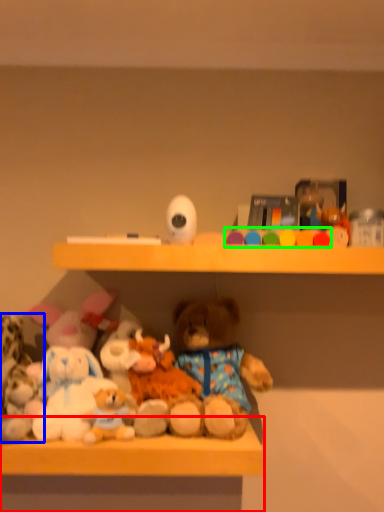
Question: Considering the real-world distances, which object is farthest from table (highlighted by a red box)? toy (highlighted by a blue box) or toy (highlighted by a green box)?

Choices:
 (A) toy
 (B) toy

Answer: (B)